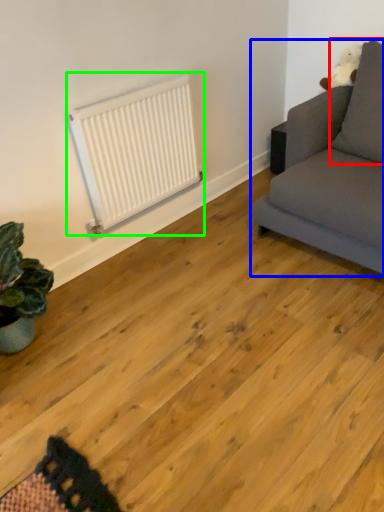
Question: Estimate the real-world distances between objects in this image. Which object is farther from pillow (highlighted by a red box), studio couch (highlighted by a blue box) or radiator (highlighted by a green box)?

Choices:
 (A) studio couch
 (B) radiator

Answer: (B)